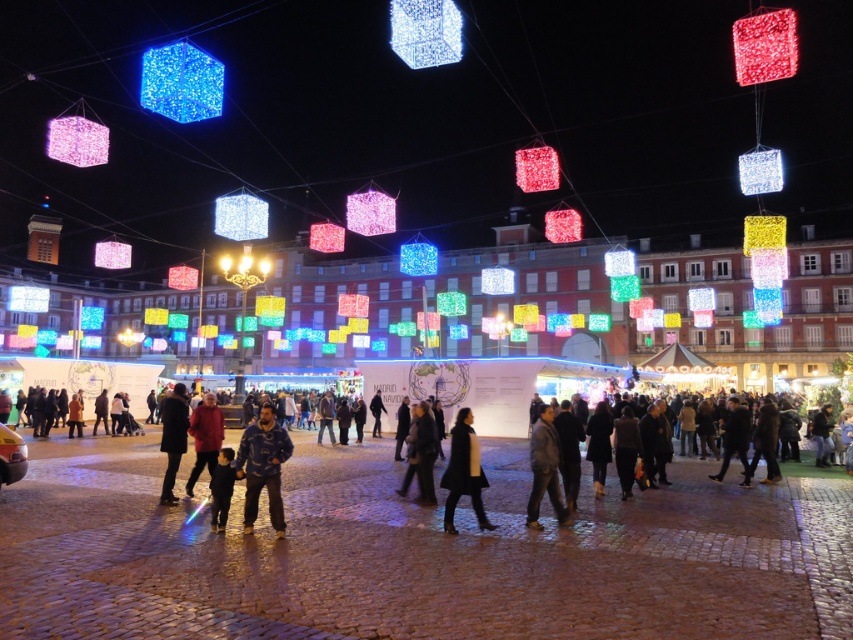
Does matte blue cube at upper left have a larger size compared to red matte jacket at center?

Actually, matte blue cube at upper left might be smaller than red matte jacket at center.

Which is above, matte blue cube at upper left or red matte jacket at center?

matte blue cube at upper left

Image resolution: width=853 pixels, height=640 pixels. Describe the element at coordinates (181, 83) in the screenshot. I see `matte blue cube at upper left` at that location.

Locate an element on the screen. matte blue cube at upper left is located at coordinates (181, 83).

From the picture: Which is more to the right, black wool coat at center or dark brown leather jacket at lower left?

From the viewer's perspective, black wool coat at center appears more on the right side.

Does black wool coat at center have a lesser width compared to dark brown leather jacket at lower left?

Yes, black wool coat at center is thinner than dark brown leather jacket at lower left.

Image resolution: width=853 pixels, height=640 pixels. Find the location of `black wool coat at center`. black wool coat at center is located at coordinates (463, 472).

Where is `black wool coat at center`? black wool coat at center is located at coordinates (463, 472).

Can you confirm if blue fleece jacket at center is bigger than dark brown leather jacket at lower left?

Actually, blue fleece jacket at center might be smaller than dark brown leather jacket at lower left.

Is blue fleece jacket at center thinner than dark brown leather jacket at lower left?

Yes, blue fleece jacket at center is thinner than dark brown leather jacket at lower left.

Who is more forward, (259, 460) or (183, 401)?

Point (259, 460)

Locate an element on the screen. The height and width of the screenshot is (640, 853). blue fleece jacket at center is located at coordinates (263, 467).